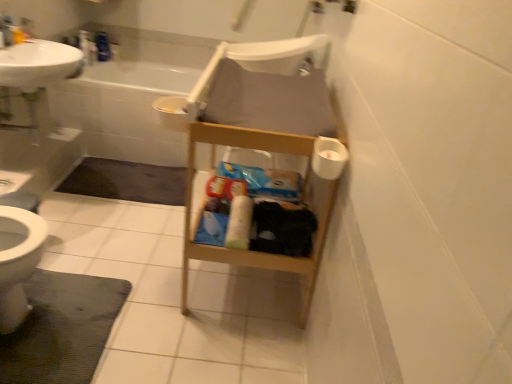
This screenshot has width=512, height=384. What are the coordinates of `vacant area that lies between dark gray textured bath mat at lower left, the 1th bath mat when ordered from front to back, and dark gray carpet at lower left, placed as the 2th bath mat when sorted from front to back` in the screenshot? It's located at (114, 230).